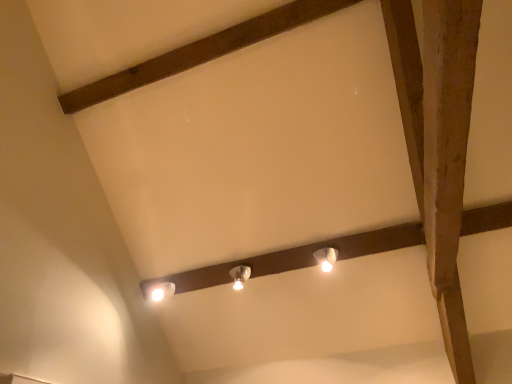
Measure the distance between white glossy lamp at upper center, the second lamp viewed from the left, and camera.

The depth of white glossy lamp at upper center, the second lamp viewed from the left, is 2.19 meters.

What do you see at coordinates (240, 276) in the screenshot? Image resolution: width=512 pixels, height=384 pixels. I see `white glossy lamp at center, which is counted as the 1th lamp, starting from the back` at bounding box center [240, 276].

Image resolution: width=512 pixels, height=384 pixels. Find the location of `white glossy lamp at upper center, marked as the second lamp in a back-to-front arrangement`. white glossy lamp at upper center, marked as the second lamp in a back-to-front arrangement is located at coordinates (326, 258).

Can you confirm if brown wooden plank at upper center is bigger than white glossy lamp at center, which appears as the 2th lamp when viewed from the right?

Yes.

Is brown wooden plank at upper center to the left of white glossy lamp at center, the 2th lamp viewed from the front, from the viewer's perspective?

Yes.

From a real-world perspective, which is physically below, brown wooden plank at upper center or white glossy lamp at center, the 2th lamp viewed from the front?

white glossy lamp at center, the 2th lamp viewed from the front, from a real-world perspective.

Choose the correct answer: Is brown wooden plank at upper center inside white glossy lamp at center, which is counted as the 1th lamp, starting from the left, or outside it?

brown wooden plank at upper center is spatially situated outside white glossy lamp at center, which is counted as the 1th lamp, starting from the left.

From the picture: Could you tell me if white glossy lamp at center, which appears as the 2th lamp when viewed from the right, is facing white glossy lamp at upper center, which appears as the 1th lamp when viewed from the right?

No.

From a real-world perspective, is white glossy lamp at center, the 2th lamp viewed from the front, beneath white glossy lamp at upper center, which appears as the 1th lamp when viewed from the right?

No, from a real-world perspective, white glossy lamp at center, the 2th lamp viewed from the front, is not below white glossy lamp at upper center, which appears as the 1th lamp when viewed from the right.

How distant is white glossy lamp at center, the 2th lamp viewed from the front, from white glossy lamp at upper center, the second lamp viewed from the left?

The distance of white glossy lamp at center, the 2th lamp viewed from the front, from white glossy lamp at upper center, the second lamp viewed from the left, is 16.21 inches.

Considering the sizes of objects white glossy lamp at center, which is counted as the 1th lamp, starting from the left, and white glossy lamp at upper center, which is the first lamp from front to back, in the image provided, who is shorter, white glossy lamp at center, which is counted as the 1th lamp, starting from the left, or white glossy lamp at upper center, which is the first lamp from front to back,?

Standing shorter between the two is white glossy lamp at upper center, which is the first lamp from front to back.

From a real-world perspective, is brown wooden plank at upper center located beneath white glossy lamp at upper center, which is the first lamp from front to back?

Incorrect, from a real-world perspective, brown wooden plank at upper center is higher than white glossy lamp at upper center, which is the first lamp from front to back.

Does brown wooden plank at upper center touch white glossy lamp at upper center, which is the first lamp from front to back?

brown wooden plank at upper center and white glossy lamp at upper center, which is the first lamp from front to back, are not in contact.

Is point (77, 90) more distant than point (329, 258)?

Yes, it is.

Is white glossy lamp at upper center, which appears as the 1th lamp when viewed from the right, at the left side of brown wooden plank at upper center?

In fact, white glossy lamp at upper center, which appears as the 1th lamp when viewed from the right, is to the right of brown wooden plank at upper center.

Is white glossy lamp at upper center, which appears as the 1th lamp when viewed from the right, beside brown wooden plank at upper center?

No, white glossy lamp at upper center, which appears as the 1th lamp when viewed from the right, is not next to brown wooden plank at upper center.

In terms of size, does white glossy lamp at upper center, the second lamp viewed from the left, appear bigger or smaller than brown wooden plank at upper center?

In the image, white glossy lamp at upper center, the second lamp viewed from the left, appears to be smaller than brown wooden plank at upper center.

Can you confirm if white glossy lamp at center, which is counted as the 1th lamp, starting from the back, is positioned to the left of brown wooden plank at upper center?

Incorrect, white glossy lamp at center, which is counted as the 1th lamp, starting from the back, is not on the left side of brown wooden plank at upper center.

Is white glossy lamp at center, which appears as the 2th lamp when viewed from the right, bigger or smaller than brown wooden plank at upper center?

white glossy lamp at center, which appears as the 2th lamp when viewed from the right, is smaller than brown wooden plank at upper center.

Does white glossy lamp at center, the 2th lamp viewed from the front, lie behind brown wooden plank at upper center?

Yes, white glossy lamp at center, the 2th lamp viewed from the front, is further from the viewer.

Which is behind, point (248, 269) or point (197, 41)?

Point (248, 269)

From a real-world perspective, which object rests below the other?

In real-world perspective, white glossy lamp at upper center, which appears as the 1th lamp when viewed from the right, is lower.

From the image's perspective, which one is positioned higher, white glossy lamp at upper center, which appears as the 1th lamp when viewed from the right, or white glossy lamp at center, which is counted as the 1th lamp, starting from the left?

white glossy lamp at upper center, which appears as the 1th lamp when viewed from the right, from the image's perspective.

Considering the positions of objects white glossy lamp at upper center, the second lamp viewed from the left, and white glossy lamp at center, which appears as the 2th lamp when viewed from the right, in the image provided, who is more to the left, white glossy lamp at upper center, the second lamp viewed from the left, or white glossy lamp at center, which appears as the 2th lamp when viewed from the right,?

white glossy lamp at center, which appears as the 2th lamp when viewed from the right, is more to the left.

Locate an element on the screen. This screenshot has width=512, height=384. the 2nd lamp behind the brown wooden plank at upper center is located at coordinates (240, 276).

In the image, there is a white glossy lamp at upper center, marked as the second lamp in a back-to-front arrangement. Identify the location of lamp below it (from the image's perspective). This screenshot has height=384, width=512. (240, 276).

Estimate the real-world distances between objects in this image. Which object is closer to brown wooden plank at upper center, white glossy lamp at upper center, the second lamp viewed from the left, or white glossy lamp at center, which is counted as the 1th lamp, starting from the left?

white glossy lamp at center, which is counted as the 1th lamp, starting from the left, is positioned closer to the anchor brown wooden plank at upper center.

Looking at the image, which one is located further to white glossy lamp at center, the 2th lamp viewed from the front, brown wooden plank at upper center or white glossy lamp at upper center, the second lamp viewed from the left?

brown wooden plank at upper center is positioned further to the anchor white glossy lamp at center, the 2th lamp viewed from the front.

When comparing their distances from white glossy lamp at upper center, marked as the second lamp in a back-to-front arrangement, does brown wooden plank at upper center or white glossy lamp at center, which is counted as the 1th lamp, starting from the back, seem closer?

white glossy lamp at center, which is counted as the 1th lamp, starting from the back.

Looking at the image, which one is located further to white glossy lamp at center, which appears as the 2th lamp when viewed from the right, white glossy lamp at upper center, the second lamp viewed from the left, or brown wooden plank at upper center?

Based on the image, brown wooden plank at upper center appears to be further to white glossy lamp at center, which appears as the 2th lamp when viewed from the right.

From the image, which object appears to be farther from brown wooden plank at upper center, white glossy lamp at center, the 2th lamp viewed from the front, or white glossy lamp at upper center, marked as the second lamp in a back-to-front arrangement?

white glossy lamp at upper center, marked as the second lamp in a back-to-front arrangement, is further to brown wooden plank at upper center.

Based on their spatial positions, is white glossy lamp at center, the 2th lamp viewed from the front, or brown wooden plank at upper center closer to white glossy lamp at upper center, marked as the second lamp in a back-to-front arrangement?

The object closer to white glossy lamp at upper center, marked as the second lamp in a back-to-front arrangement, is white glossy lamp at center, the 2th lamp viewed from the front.

The image size is (512, 384). Identify the location of lamp that lies between brown wooden plank at upper center and white glossy lamp at center, the 2th lamp viewed from the front, from top to bottom. (326, 258).